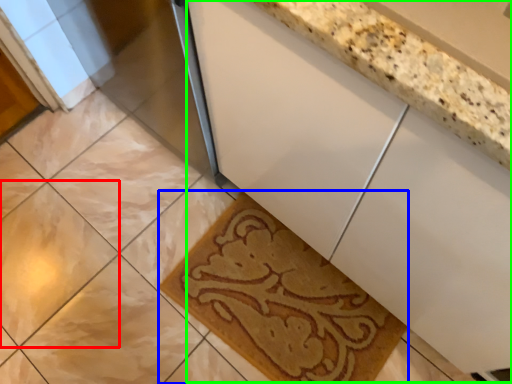
Question: Which object is positioned farthest from ceramic tile (highlighted by a red box)? Select from bath mat (highlighted by a blue box) and counter (highlighted by a green box).

Choices:
 (A) bath mat
 (B) counter

Answer: (B)